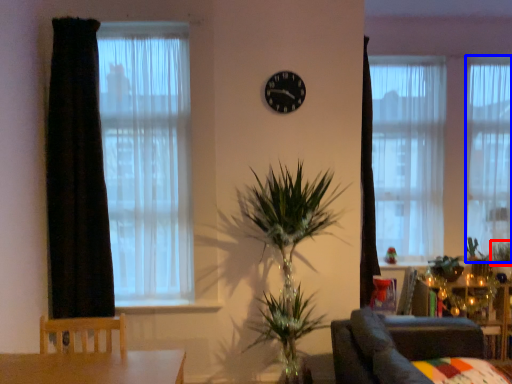
Question: Which of the following is the closest to the observer, plant (highlighted by a red box) or curtain (highlighted by a blue box)?

Choices:
 (A) plant
 (B) curtain

Answer: (A)